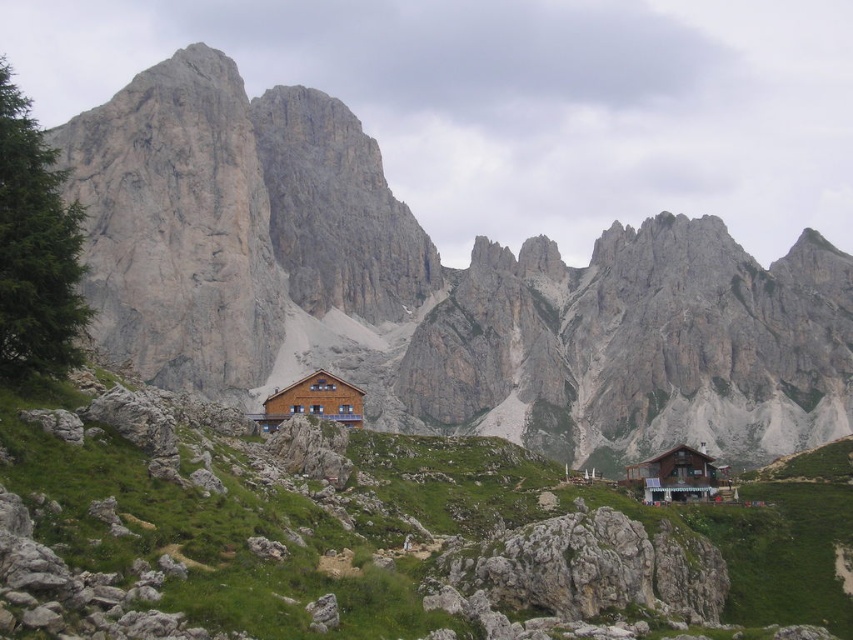
You are a hiker who wants to reach the wooden cabin at lower right from your current position near the matte brown wooden cabin at center. Based on the distance between them, can you estimate how long it would take you to walk there at a normal pace?

The matte brown wooden cabin at center is 214.27 feet away from wooden cabin at lower right. At a normal walking pace of about 3 feet per second, it would take approximately 71 seconds, or roughly 1 minute and 11 seconds, to reach the wooden cabin at lower right.

You are planning a hiking route and need to pass by both the wooden cabin at center and the wooden cabin at lower right. Based on the scene, which cabin should you approach first to ensure you can see both from the trail?

You should approach the wooden cabin at center first because the wooden cabin at lower right is behind it, so you can see both cabins from the trail by starting with the one in front.

You are a hiker planning to travel from point A to point B in the mountainous landscape. Point A is at coordinate point (x=335, y=403) and point B is at coordinate point (x=631, y=481). Based on the terrain, which point is closer to you as you start your hike?

Point A at coordinate point (x=335, y=403) is closer to you as it is further to the viewer compared to point B at coordinate point (x=631, y=481).